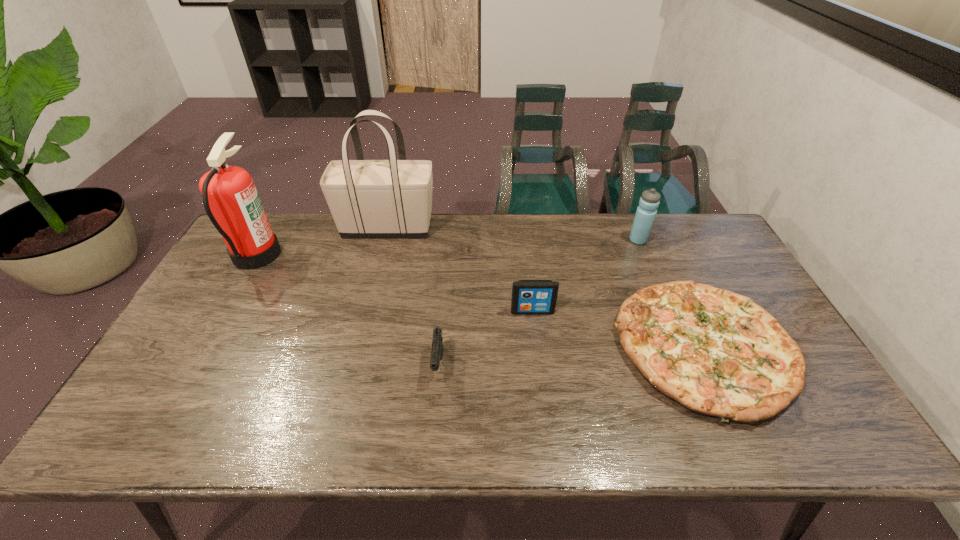
Identify the location of free point between the pistol and the shortest object. Image resolution: width=960 pixels, height=540 pixels. (571, 356).

You are a GUI agent. You are given a task and a screenshot of the screen. Output one action in this format:
    pyautogui.click(x=<x>, y=<y>)
    Task: Click on the free space between the leftmost object and the shopping bag
    
    Given the screenshot: What is the action you would take?
    pyautogui.click(x=322, y=241)

Image resolution: width=960 pixels, height=540 pixels. I want to click on empty space between the third tallest object and the third shortest object, so click(586, 276).

Select which object is the third closest to the water bottle. Please provide its 2D coordinates. Your answer should be formatted as a tuple, i.e. [(x, y)], where the tuple contains the x and y coordinates of a point satisfying the conditions above.

[(392, 198)]

Identify which object is the closest to the third object from right to left. Please provide its 2D coordinates. Your answer should be formatted as a tuple, i.e. [(x, y)], where the tuple contains the x and y coordinates of a point satisfying the conditions above.

[(716, 352)]

The width and height of the screenshot is (960, 540). Identify the location of vacant region that satisfies the following two spatial constraints: 1. on the back side of the pizza; 2. at the nozzle of the fire extinguisher. (660, 254).

Find the location of a particular element. The width and height of the screenshot is (960, 540). vacant area that satisfies the following two spatial constraints: 1. on the front screen of the iPod; 2. on the left side of the pizza is located at coordinates (537, 347).

You are a GUI agent. You are given a task and a screenshot of the screen. Output one action in this format:
    pyautogui.click(x=<x>, y=<y>)
    Task: Click on the vacant position in the image that satisfies the following two spatial constraints: 1. with handles facing forward on the second object from left to right; 2. on the left side of the fourth shortest object
    The width and height of the screenshot is (960, 540).
    Given the screenshot: What is the action you would take?
    pyautogui.click(x=384, y=240)

This screenshot has height=540, width=960. Identify the location of blank space that satisfies the following two spatial constraints: 1. on the back side of the pizza; 2. with handles facing forward on the shopping bag. (649, 227).